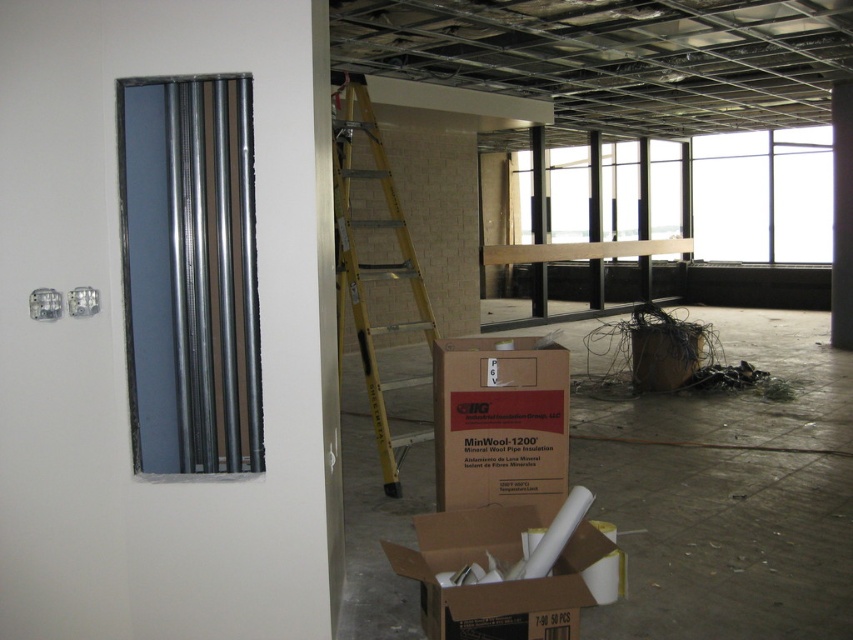
Is cardboard box at lower center smaller than yellow fiberglass ladder at center?

Correct, cardboard box at lower center occupies less space than yellow fiberglass ladder at center.

Does cardboard box at lower center have a greater width compared to yellow fiberglass ladder at center?

Yes.

This screenshot has width=853, height=640. I want to click on cardboard box at lower center, so click(x=506, y=570).

Does cardboard box at lower center appear under brown cardboard box at center-right?

Yes, cardboard box at lower center is below brown cardboard box at center-right.

Does cardboard box at lower center have a greater width compared to brown cardboard box at center-right?

Correct, the width of cardboard box at lower center exceeds that of brown cardboard box at center-right.

Who is more distant from viewer, (512, 627) or (650, 369)?

The point (650, 369) is behind.

Find the location of `cardboard box at lower center`. cardboard box at lower center is located at coordinates (506, 570).

The image size is (853, 640). In order to click on brown cardboard box at center in this screenshot , I will do `click(498, 420)`.

Is brown cardboard box at center to the right of brown cardboard box at center-right from the viewer's perspective?

Incorrect, brown cardboard box at center is not on the right side of brown cardboard box at center-right.

Is point (563, 401) closer to viewer compared to point (653, 352)?

Yes.

Locate an element on the screen. The height and width of the screenshot is (640, 853). brown cardboard box at center is located at coordinates (498, 420).